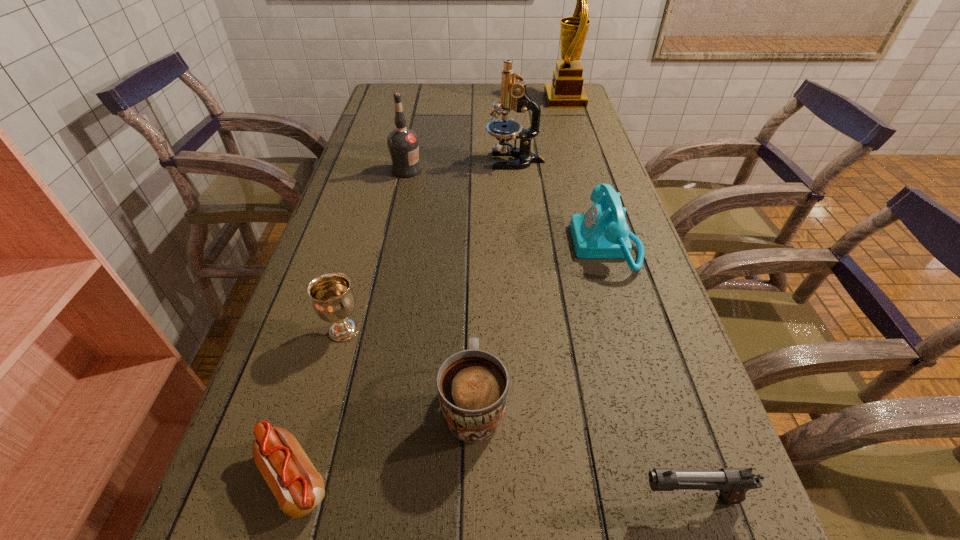
The image size is (960, 540). What are the coordinates of `free space in the image that satisfies the following two spatial constraints: 1. on the front-facing side of the farthest object; 2. on the front side of the fourth nearest object` in the screenshot? It's located at (638, 330).